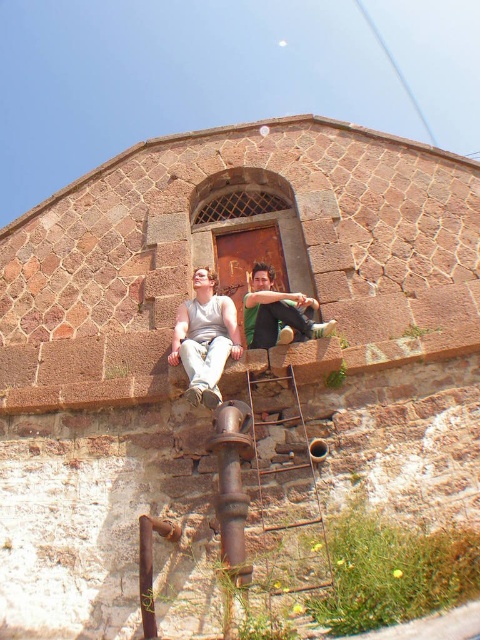
You are a fashion designer observing the scene. You notice a point at coordinates (204,337). What clothing item is located at that point?

The point at coordinates (204,337) corresponds to the gray matte tank top at center.

You are a painter standing at the base of the stone structure. You need to paint the green fabric shirt at upper center but there is a rusty metal pipe at center blocking your view. Can you paint the shirt without moving the pipe?

The rusty metal pipe at center is in front of the green fabric shirt at upper center, so you cannot paint the shirt without moving the pipe.